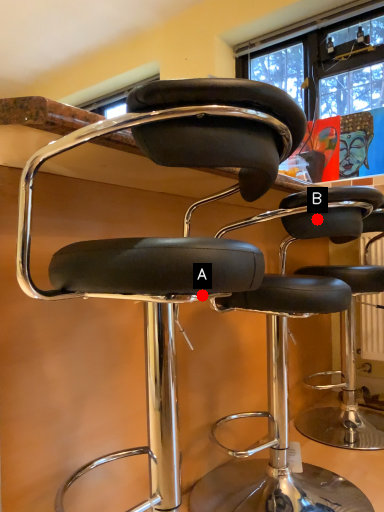
Question: Two points are circled on the image, labeled by A and B beside each circle. Which point is farther to the camera?

Choices:
 (A) A is further
 (B) B is further

Answer: (B)